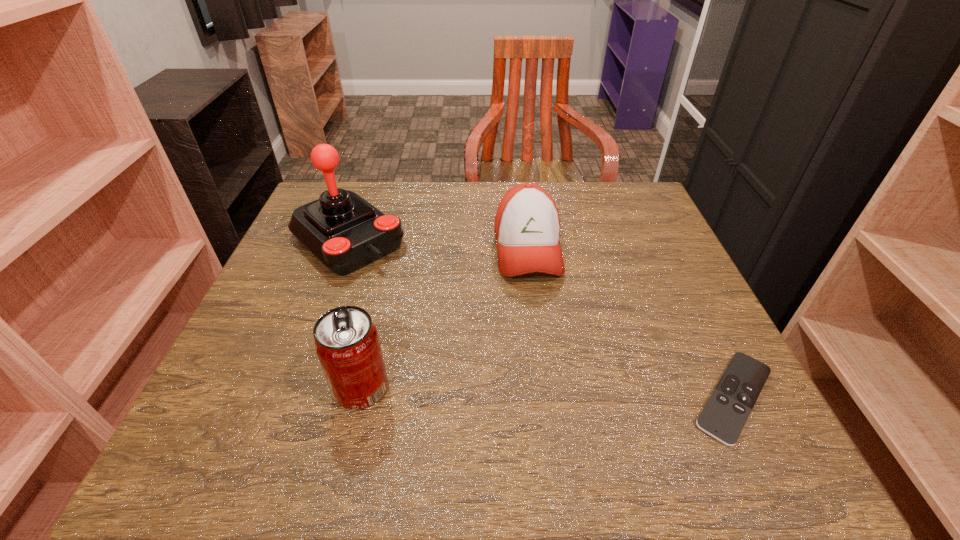
You are a GUI agent. You are given a task and a screenshot of the screen. Output one action in this format:
    pyautogui.click(x=<x>, y=<y>)
    Task: Click on the pop soda
    The image size is (960, 540).
    Given the screenshot: What is the action you would take?
    pyautogui.click(x=346, y=341)

Where is `remote control`? remote control is located at coordinates (723, 417).

Locate an element on the screen. the shortest object is located at coordinates click(723, 417).

The width and height of the screenshot is (960, 540). I want to click on the third object from left to right, so click(x=527, y=226).

Where is `baseball cap`? baseball cap is located at coordinates (527, 226).

Locate an element on the screen. joystick is located at coordinates (345, 232).

Locate an element on the screen. This screenshot has width=960, height=540. free location located on the left of the pop soda is located at coordinates (228, 388).

Identify the location of free space located 0.210m on the left of the shortest object. (561, 397).

Image resolution: width=960 pixels, height=540 pixels. I want to click on free location located on the front-facing side of the baseball cap, so click(555, 401).

At what (x,y) coordinates should I click in order to perform the action: click on vacant space located on the front-facing side of the baseball cap. Please return your answer as a coordinate pair (x, y). The height and width of the screenshot is (540, 960). Looking at the image, I should click on (554, 396).